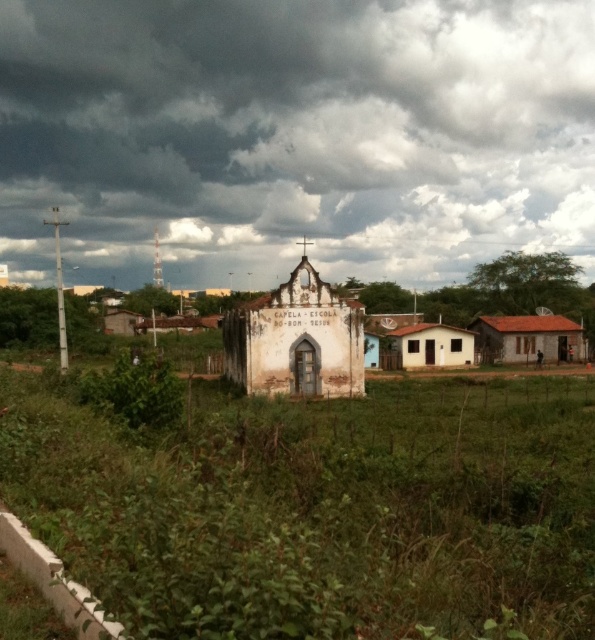
Question: Which point appears farthest from the camera in this image?

Choices:
 (A) (408, 3)
 (B) (277, 333)

Answer: (A)

Question: Does dark gray cloud at upper center have a lesser width compared to green leafy plant at lower left?

Choices:
 (A) yes
 (B) no

Answer: (B)

Question: Which object is closer to the camera taking this photo?

Choices:
 (A) dark gray cloud at upper center
 (B) white weathered chapel at center

Answer: (B)

Question: Can you confirm if dark gray cloud at upper center is positioned to the left of white weathered chapel at center?

Choices:
 (A) no
 (B) yes

Answer: (B)

Question: Which object is closer to the camera taking this photo?

Choices:
 (A) white weathered chapel at center
 (B) dark gray cloud at upper center

Answer: (A)

Question: Observing the image, what is the correct spatial positioning of dark gray cloud at upper center in reference to white weathered chapel at center?

Choices:
 (A) left
 (B) right

Answer: (A)